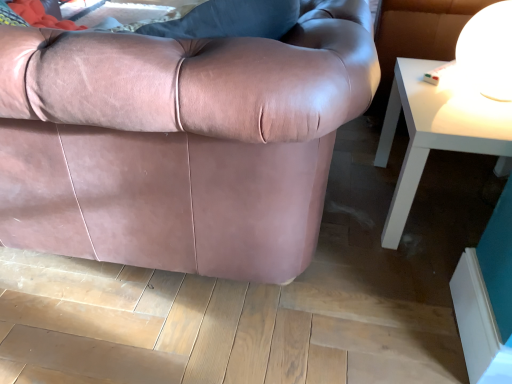
This screenshot has height=384, width=512. In order to click on white glossy table at upper right in this screenshot , I will do `click(437, 131)`.

Image resolution: width=512 pixels, height=384 pixels. I want to click on white glossy table lamp at upper right, so click(488, 51).

Are white glossy table lamp at upper right and white glossy table at upper right located far from each other?

white glossy table lamp at upper right is actually quite close to white glossy table at upper right.

Is white glossy table at upper right at the back of white glossy table lamp at upper right?

No.

Which object is positioned more to the left, white glossy table lamp at upper right or white glossy table at upper right?

white glossy table lamp at upper right.

Which is less distant, [502,55] or [418,158]?

The point [502,55] is closer.

Could you tell me if white glossy table at upper right is facing matte pink leather couch at center?

No, white glossy table at upper right does not turn towards matte pink leather couch at center.

Are white glossy table at upper right and matte pink leather couch at center beside each other?

No, white glossy table at upper right is not in contact with matte pink leather couch at center.

Which of these two, white glossy table at upper right or matte pink leather couch at center, is thinner?

white glossy table at upper right.

Which of these two, white glossy table lamp at upper right or matte pink leather couch at center, is thinner?

white glossy table lamp at upper right.

Is point (499, 17) in front of point (98, 247)?

That is True.

Would you say white glossy table lamp at upper right is to the left or to the right of matte pink leather couch at center in the picture?

Clearly, white glossy table lamp at upper right is on the right of matte pink leather couch at center in the image.

Can you confirm if matte pink leather couch at center is wider than white glossy table lamp at upper right?

Indeed, matte pink leather couch at center has a greater width compared to white glossy table lamp at upper right.

Find the location of `table lamp behind the matte pink leather couch at center`. table lamp behind the matte pink leather couch at center is located at coordinates (488, 51).

Considering the sizes of matte pink leather couch at center and white glossy table lamp at upper right in the image, is matte pink leather couch at center taller or shorter than white glossy table lamp at upper right?

In the image, matte pink leather couch at center appears to be taller than white glossy table lamp at upper right.

Is matte pink leather couch at center directly adjacent to white glossy table lamp at upper right?

matte pink leather couch at center and white glossy table lamp at upper right are not in contact.

From the image's perspective, is white glossy table at upper right above white glossy table lamp at upper right?

No, from the image's perspective, white glossy table at upper right is not on top of white glossy table lamp at upper right.

Is white glossy table at upper right turned away from white glossy table lamp at upper right?

No, white glossy table at upper right is not facing away from white glossy table lamp at upper right.

Is white glossy table at upper right wider than white glossy table lamp at upper right?

Yes.

Can you tell me how much white glossy table at upper right and white glossy table lamp at upper right differ in facing direction?

The angular difference between white glossy table at upper right and white glossy table lamp at upper right is 90.4 degrees.

Based on the photo, is matte pink leather couch at center taller than white glossy table at upper right?

Correct, matte pink leather couch at center is much taller as white glossy table at upper right.

Is matte pink leather couch at center next to white glossy table at upper right?

No, matte pink leather couch at center is not touching white glossy table at upper right.

From a real-world perspective, is matte pink leather couch at center located higher than white glossy table at upper right?

Correct, in the physical world, matte pink leather couch at center is higher than white glossy table at upper right.

Does point (46, 190) lie in front of point (470, 96)?

Yes, it is.

You are a GUI agent. You are given a task and a screenshot of the screen. Output one action in this format:
    pyautogui.click(x=<x>, y=<y>)
    Task: Click on the table behind the white glossy table lamp at upper right
    
    Given the screenshot: What is the action you would take?
    pyautogui.click(x=437, y=131)

Where is `studio couch in front of the white glossy table at upper right`? The image size is (512, 384). studio couch in front of the white glossy table at upper right is located at coordinates (180, 142).

Which object lies nearer to the anchor point white glossy table lamp at upper right, white glossy table at upper right or matte pink leather couch at center?

Among the two, white glossy table at upper right is located nearer to white glossy table lamp at upper right.

Based on their spatial positions, is white glossy table lamp at upper right or white glossy table at upper right further from matte pink leather couch at center?

Among the two, white glossy table lamp at upper right is located further to matte pink leather couch at center.

Estimate the real-world distances between objects in this image. Which object is closer to white glossy table lamp at upper right, matte pink leather couch at center or white glossy table at upper right?

white glossy table at upper right is closer to white glossy table lamp at upper right.

Which object lies nearer to the anchor point matte pink leather couch at center, white glossy table at upper right or white glossy table lamp at upper right?

The object closer to matte pink leather couch at center is white glossy table at upper right.

Based on their spatial positions, is white glossy table lamp at upper right or matte pink leather couch at center closer to white glossy table at upper right?

white glossy table lamp at upper right.

When comparing their distances from white glossy table at upper right, does matte pink leather couch at center or white glossy table lamp at upper right seem closer?

white glossy table lamp at upper right is closer to white glossy table at upper right.

Image resolution: width=512 pixels, height=384 pixels. In order to click on table lamp between matte pink leather couch at center and white glossy table at upper right in the horizontal direction in this screenshot , I will do `click(488, 51)`.